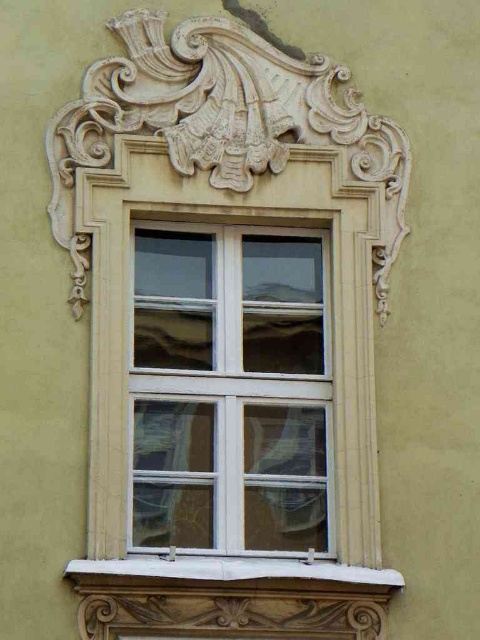
Does clear glass window at center have a smaller size compared to white stone window sill at lower center?

Incorrect, clear glass window at center is not smaller in size than white stone window sill at lower center.

Can you confirm if clear glass window at center is taller than white stone window sill at lower center?

Correct, clear glass window at center is much taller as white stone window sill at lower center.

What do you see at coordinates (229, 388) in the screenshot?
I see `clear glass window at center` at bounding box center [229, 388].

Identify the location of clear glass window at center. This screenshot has width=480, height=640. (229, 388).